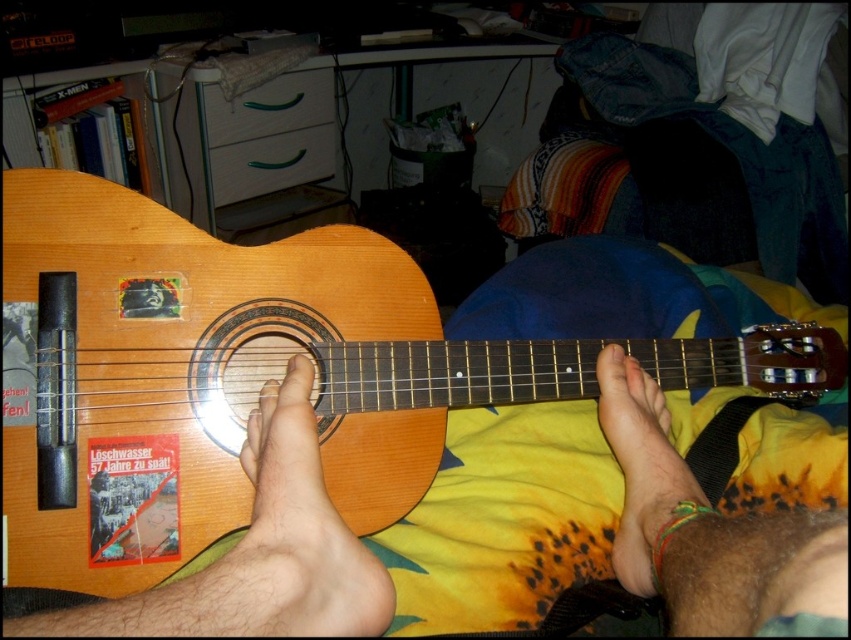
I want to click on natural wood guitar at center, so click(x=216, y=376).

Between natural wood guitar at center and brown leather foot at lower right, which one appears on the right side from the viewer's perspective?

From the viewer's perspective, brown leather foot at lower right appears more on the right side.

Find the location of a particular element. The width and height of the screenshot is (851, 640). natural wood guitar at center is located at coordinates (216, 376).